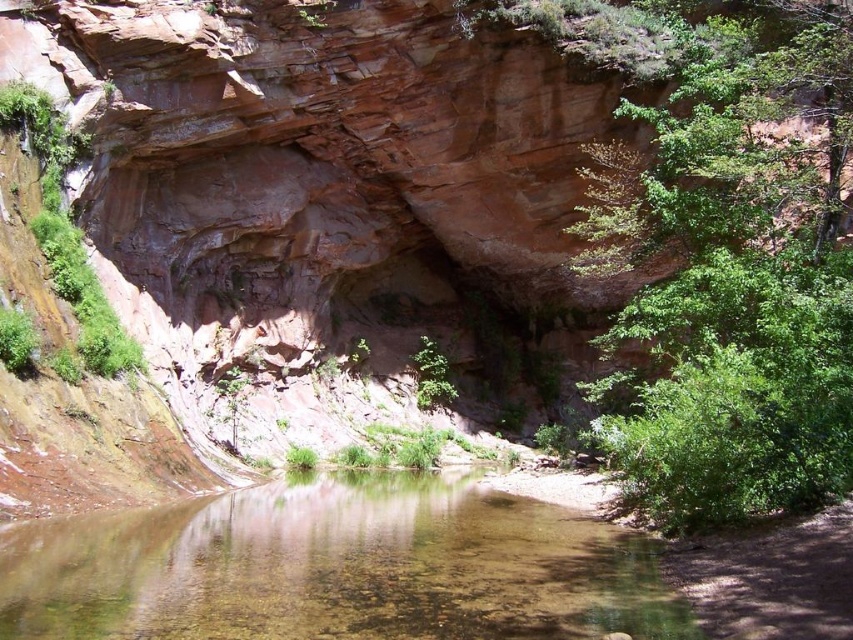
Question: Is green leafy tree at right in front of clear water at center?

Choices:
 (A) no
 (B) yes

Answer: (A)

Question: Which of the following is the farthest from the observer?

Choices:
 (A) green leafy tree at right
 (B) clear water at center

Answer: (A)

Question: Is green leafy tree at right thinner than clear water at center?

Choices:
 (A) yes
 (B) no

Answer: (A)

Question: Does green leafy tree at right lie in front of clear water at center?

Choices:
 (A) no
 (B) yes

Answer: (A)